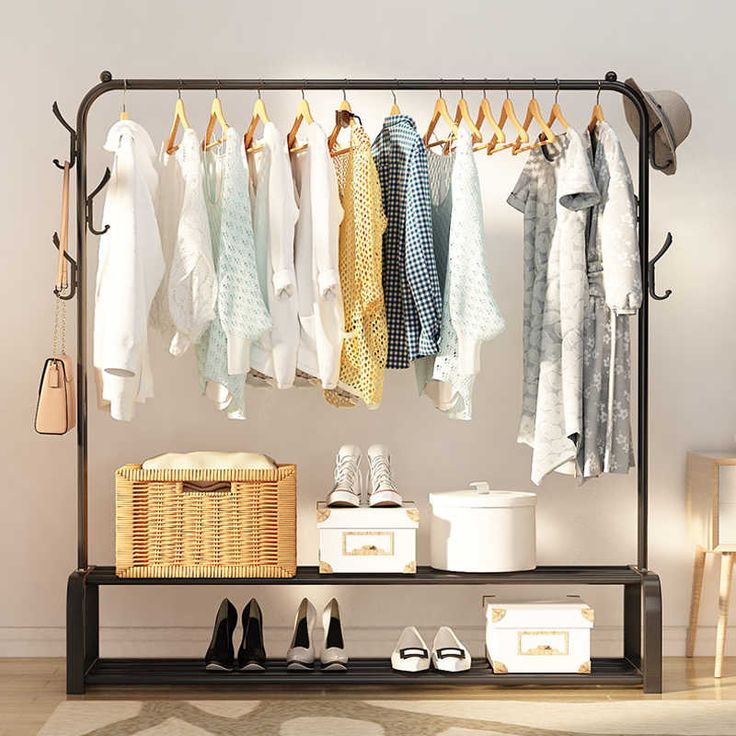
You are a GUI agent. You are given a task and a screenshot of the screen. Output one action in this format:
    pyautogui.click(x=<x>, y=<y>)
    Task: Click on the coat hooks
    This screenshot has width=736, height=736.
    Given the screenshot: What is the action you would take?
    pyautogui.click(x=665, y=244), pyautogui.click(x=654, y=127), pyautogui.click(x=657, y=296), pyautogui.click(x=99, y=183), pyautogui.click(x=101, y=229), pyautogui.click(x=68, y=260), pyautogui.click(x=68, y=296), pyautogui.click(x=57, y=112), pyautogui.click(x=59, y=165)